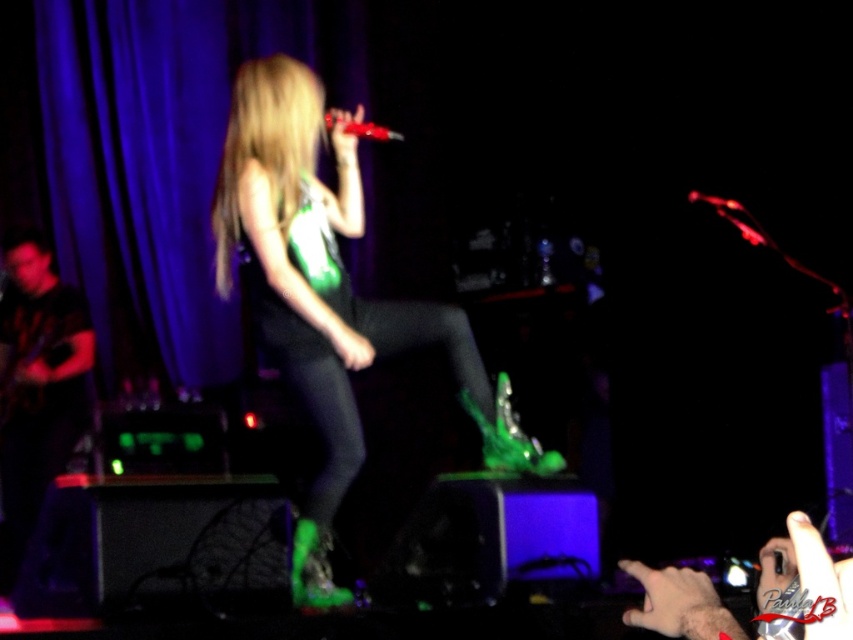
Question: Which point is farther to the camera?

Choices:
 (A) (363, 157)
 (B) (334, 118)
 (C) (701, 200)
 (D) (433, 340)

Answer: (A)

Question: Which point is farther to the camera?

Choices:
 (A) (328, 390)
 (B) (722, 202)

Answer: (B)

Question: Is purple fabric curtain at upper left to the left of shiny red microphone at center from the viewer's perspective?

Choices:
 (A) no
 (B) yes

Answer: (B)

Question: Does green matte boots at center have a greater width compared to shiny red microphone at center?

Choices:
 (A) yes
 (B) no

Answer: (A)

Question: Does green matte boots at center appear under shiny red microphone at center?

Choices:
 (A) yes
 (B) no

Answer: (A)

Question: Among these objects, which one is nearest to the camera?

Choices:
 (A) green matte boots at center
 (B) shiny red microphone at center
 (C) translucent plastic microphone at upper right
 (D) purple fabric curtain at upper left

Answer: (A)